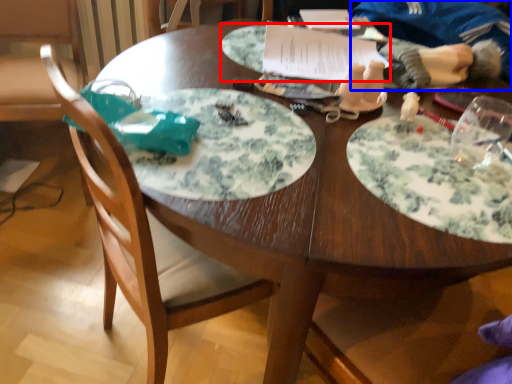
Question: Which object appears closest to the camera in this image, platter (highlighted by a red box) or person (highlighted by a blue box)?

Choices:
 (A) platter
 (B) person

Answer: (B)